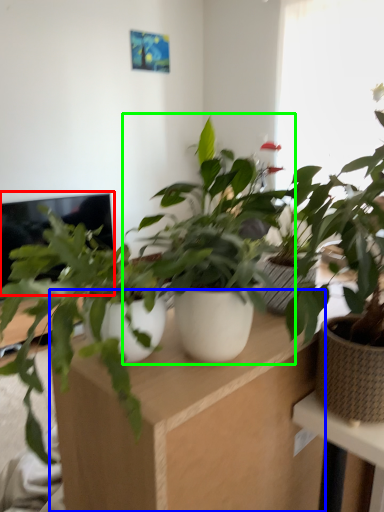
Question: Which object is the farthest from computer screen (highlighted by a red box)? Choose among these: computer desk (highlighted by a blue box) or houseplant (highlighted by a green box).

Choices:
 (A) computer desk
 (B) houseplant

Answer: (A)